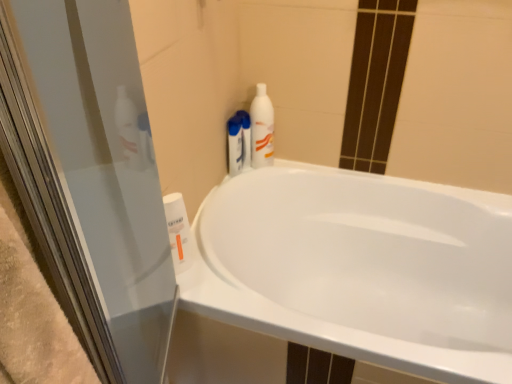
Describe the element at coordinates (360, 268) in the screenshot. I see `white glossy bathtub at center` at that location.

Where is `white glossy bottle at upper right, which is counted as the third cleaning product, starting from the left`? The image size is (512, 384). white glossy bottle at upper right, which is counted as the third cleaning product, starting from the left is located at coordinates (262, 128).

The width and height of the screenshot is (512, 384). What are the coordinates of `white glossy bottle at lower left, the third cleaning product when ordered from right to left` in the screenshot? It's located at (178, 231).

In order to click on white glossy bottle at upper right, which appears as the 2th cleaning product when viewed from the top in this screenshot , I will do `click(239, 142)`.

Between white glossy bottle at upper right, the third cleaning product when ordered from front to back, and white glossy bottle at lower left, the third cleaning product positioned from the back, which one has smaller size?

white glossy bottle at upper right, the third cleaning product when ordered from front to back, is smaller.

Does point (236, 154) lie behind point (186, 230)?

Yes, it is behind point (186, 230).

Does white glossy bottle at lower left, the third cleaning product when ordered from right to left, appear on the left side of white glossy bathtub at center?

Correct, you'll find white glossy bottle at lower left, the third cleaning product when ordered from right to left, to the left of white glossy bathtub at center.

From a real-world perspective, relative to white glossy bathtub at center, is white glossy bottle at lower left, which is the 1th cleaning product in front-to-back order, vertically above or below?

white glossy bottle at lower left, which is the 1th cleaning product in front-to-back order, is above white glossy bathtub at center.

Who is more distant, white glossy bottle at lower left, the third cleaning product when ordered from right to left, or white glossy bathtub at center?

white glossy bottle at lower left, the third cleaning product when ordered from right to left.

Are white glossy bottle at lower left, marked as the first cleaning product in a bottom-to-top arrangement, and white glossy bathtub at center making contact?

No, white glossy bottle at lower left, marked as the first cleaning product in a bottom-to-top arrangement, is not touching white glossy bathtub at center.

Does white glossy bottle at upper right, which appears as the 1th cleaning product when viewed from the top, appear on the right side of white glossy bottle at upper right, arranged as the second cleaning product when viewed from the left?

Yes, white glossy bottle at upper right, which appears as the 1th cleaning product when viewed from the top, is to the right of white glossy bottle at upper right, arranged as the second cleaning product when viewed from the left.

Are white glossy bottle at upper right, which is counted as the third cleaning product, starting from the left, and white glossy bottle at upper right, the third cleaning product when ordered from front to back, located far from each other?

white glossy bottle at upper right, which is counted as the third cleaning product, starting from the left, is actually quite close to white glossy bottle at upper right, the third cleaning product when ordered from front to back.

In the scene shown: Is white glossy bottle at upper right, which is counted as the third cleaning product, starting from the left, facing towards white glossy bottle at upper right, positioned as the 2th cleaning product in bottom-to-top order?

No, white glossy bottle at upper right, which is counted as the third cleaning product, starting from the left, is not facing towards white glossy bottle at upper right, positioned as the 2th cleaning product in bottom-to-top order.

From the image's perspective, would you say white glossy bottle at upper right, which is counted as the third cleaning product, starting from the left, is positioned over white glossy bottle at upper right, the third cleaning product when ordered from front to back?

Yes.

Is white glossy bathtub at center situated inside white glossy bottle at lower left, the third cleaning product when ordered from right to left, or outside?

white glossy bathtub at center is located beyond the bounds of white glossy bottle at lower left, the third cleaning product when ordered from right to left.

Considering the sizes of white glossy bathtub at center and white glossy bottle at lower left, marked as the first cleaning product in a bottom-to-top arrangement, in the image, is white glossy bathtub at center bigger or smaller than white glossy bottle at lower left, marked as the first cleaning product in a bottom-to-top arrangement,?

Considering their sizes, white glossy bathtub at center takes up more space than white glossy bottle at lower left, marked as the first cleaning product in a bottom-to-top arrangement.

You are a GUI agent. You are given a task and a screenshot of the screen. Output one action in this format:
    pyautogui.click(x=<x>, y=<y>)
    Task: Click on the bathtub that appears in front of the white glossy bottle at lower left, which is the 1th cleaning product in front-to-back order
    This screenshot has height=384, width=512.
    Given the screenshot: What is the action you would take?
    pyautogui.click(x=360, y=268)

Considering the sizes of objects white glossy bottle at upper right, positioned as the 2th cleaning product in right-to-left order, and white glossy bottle at upper right, which is the 3th cleaning product in bottom-to-top order, in the image provided, who is shorter, white glossy bottle at upper right, positioned as the 2th cleaning product in right-to-left order, or white glossy bottle at upper right, which is the 3th cleaning product in bottom-to-top order,?

Standing shorter between the two is white glossy bottle at upper right, positioned as the 2th cleaning product in right-to-left order.

Is white glossy bottle at upper right, positioned as the 2th cleaning product in bottom-to-top order, oriented away from white glossy bottle at upper right, which is counted as the third cleaning product, starting from the left?

No, white glossy bottle at upper right, positioned as the 2th cleaning product in bottom-to-top order, is not facing the opposite direction of white glossy bottle at upper right, which is counted as the third cleaning product, starting from the left.

From the image's perspective, is white glossy bottle at upper right, positioned as the 2th cleaning product in right-to-left order, located beneath white glossy bottle at upper right, which is the second cleaning product from front to back?

Yes.

Is white glossy bottle at upper right, the third cleaning product when ordered from front to back, thinner than white glossy bathtub at center?

Yes.

Would you say white glossy bottle at upper right, positioned as the 2th cleaning product in right-to-left order, is inside or outside white glossy bathtub at center?

white glossy bottle at upper right, positioned as the 2th cleaning product in right-to-left order, is spatially situated outside white glossy bathtub at center.

From the image's perspective, which is above, white glossy bottle at upper right, arranged as the second cleaning product when viewed from the left, or white glossy bathtub at center?

white glossy bottle at upper right, arranged as the second cleaning product when viewed from the left.

From a real-world perspective, who is located higher, white glossy bottle at upper right, the 1th cleaning product viewed from the back, or white glossy bathtub at center?

From a 3D spatial view, white glossy bottle at upper right, the 1th cleaning product viewed from the back, is above.

Would you say white glossy bottle at upper right, the first cleaning product viewed from the right, is outside white glossy bottle at lower left, marked as the first cleaning product in a bottom-to-top arrangement?

Yes, white glossy bottle at upper right, the first cleaning product viewed from the right, is outside of white glossy bottle at lower left, marked as the first cleaning product in a bottom-to-top arrangement.

Who is taller, white glossy bottle at upper right, the second cleaning product viewed from the back, or white glossy bottle at lower left, which ranks as the first cleaning product in left-to-right order?

white glossy bottle at upper right, the second cleaning product viewed from the back.

Does white glossy bottle at upper right, which is counted as the third cleaning product, starting from the left, appear on the left side of white glossy bottle at lower left, the third cleaning product positioned from the back?

In fact, white glossy bottle at upper right, which is counted as the third cleaning product, starting from the left, is to the right of white glossy bottle at lower left, the third cleaning product positioned from the back.

You are a GUI agent. You are given a task and a screenshot of the screen. Output one action in this format:
    pyautogui.click(x=<x>, y=<y>)
    Task: Click on the cleaning product lying below the white glossy bottle at upper right, positioned as the 2th cleaning product in bottom-to-top order (from the image's perspective)
    The width and height of the screenshot is (512, 384).
    Given the screenshot: What is the action you would take?
    pyautogui.click(x=178, y=231)

Image resolution: width=512 pixels, height=384 pixels. I want to click on the 1st cleaning product behind when counting from the white glossy bathtub at center, so click(178, 231).

Looking at the image, which one is located closer to white glossy bottle at upper right, positioned as the 2th cleaning product in right-to-left order, white glossy bottle at upper right, the first cleaning product viewed from the right, or white glossy bottle at lower left, which ranks as the first cleaning product in left-to-right order?

white glossy bottle at upper right, the first cleaning product viewed from the right.

From the image, which object appears to be farther from white glossy bathtub at center, white glossy bottle at upper right, the 1th cleaning product viewed from the back, or white glossy bottle at lower left, placed as the third cleaning product when sorted from top to bottom?

Among the two, white glossy bottle at lower left, placed as the third cleaning product when sorted from top to bottom, is located further to white glossy bathtub at center.

Based on their spatial positions, is white glossy bottle at lower left, which is the 1th cleaning product in front-to-back order, or white glossy bottle at upper right, the 1th cleaning product viewed from the back, closer to white glossy bottle at upper right, which appears as the 1th cleaning product when viewed from the top?

Based on the image, white glossy bottle at upper right, the 1th cleaning product viewed from the back, appears to be nearer to white glossy bottle at upper right, which appears as the 1th cleaning product when viewed from the top.

Which object lies nearer to the anchor point white glossy bottle at upper right, the second cleaning product viewed from the back, white glossy bathtub at center or white glossy bottle at lower left, marked as the first cleaning product in a bottom-to-top arrangement?

white glossy bathtub at center is closer to white glossy bottle at upper right, the second cleaning product viewed from the back.

From the image, which object appears to be farther from white glossy bottle at lower left, which ranks as the first cleaning product in left-to-right order, white glossy bottle at upper right, the third cleaning product when ordered from front to back, or white glossy bathtub at center?

white glossy bathtub at center.

Considering their positions, is white glossy bathtub at center positioned closer to white glossy bottle at upper right, the second cleaning product viewed from the back, than white glossy bottle at upper right, positioned as the 2th cleaning product in bottom-to-top order?

white glossy bottle at upper right, positioned as the 2th cleaning product in bottom-to-top order.

In the scene shown: Estimate the real-world distances between objects in this image. Which object is further from white glossy bottle at upper right, the 1th cleaning product viewed from the back, white glossy bathtub at center or white glossy bottle at lower left, which ranks as the first cleaning product in left-to-right order?

Based on the image, white glossy bathtub at center appears to be further to white glossy bottle at upper right, the 1th cleaning product viewed from the back.

From the image, which object appears to be nearer to white glossy bottle at upper right, which is the 3th cleaning product in bottom-to-top order, white glossy bottle at upper right, the 1th cleaning product viewed from the back, or white glossy bottle at lower left, the third cleaning product positioned from the back?

white glossy bottle at upper right, the 1th cleaning product viewed from the back, lies closer to white glossy bottle at upper right, which is the 3th cleaning product in bottom-to-top order, than the other object.

This screenshot has height=384, width=512. I want to click on cleaning product between white glossy bottle at lower left, the third cleaning product when ordered from right to left, and white glossy bottle at upper right, the 1th cleaning product viewed from the back, from front to back, so pos(262,128).